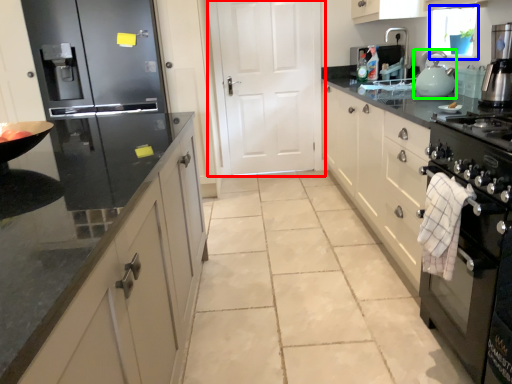
Question: Considering the real-world distances, which object is closest to door (highlighted by a red box)? window screen (highlighted by a blue box) or kitchen appliance (highlighted by a green box).

Choices:
 (A) window screen
 (B) kitchen appliance

Answer: (A)